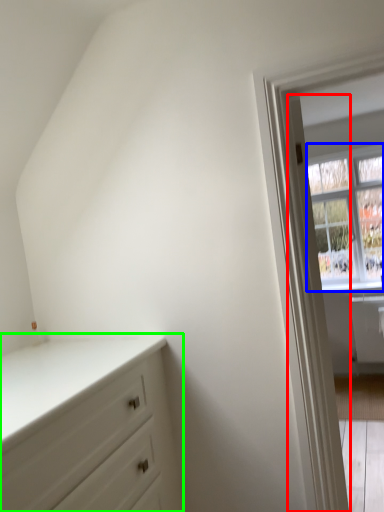
Question: Which is nearer to the door (highlighted by a red box)? window (highlighted by a blue box) or chest of drawers (highlighted by a green box).

Choices:
 (A) window
 (B) chest of drawers

Answer: (B)